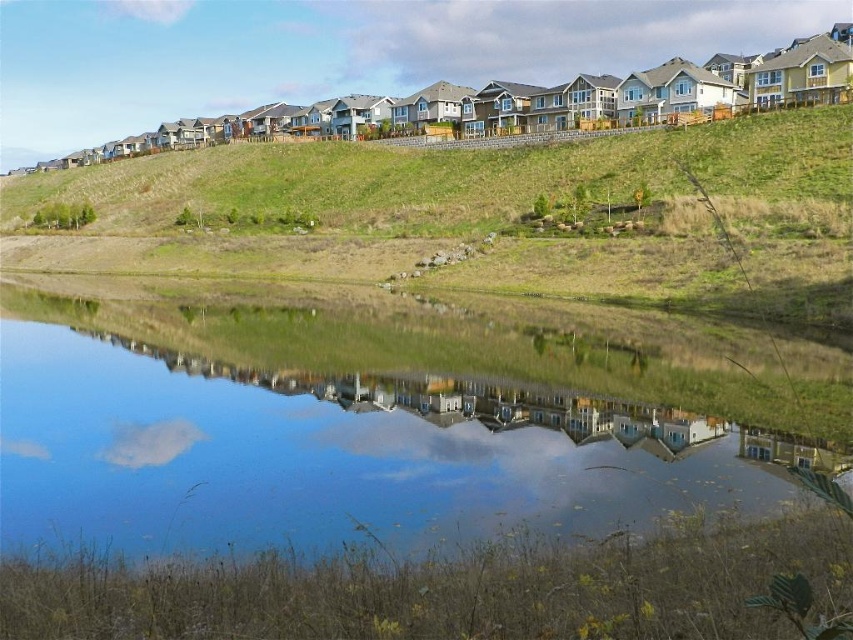
Is transparent glass water at center to the right of green grassy hillside at upper center from the viewer's perspective?

Correct, you'll find transparent glass water at center to the right of green grassy hillside at upper center.

Looking at this image, is transparent glass water at center further to camera compared to green grassy hillside at upper center?

No, it is in front of green grassy hillside at upper center.

This screenshot has width=853, height=640. Find the location of `transparent glass water at center`. transparent glass water at center is located at coordinates (347, 433).